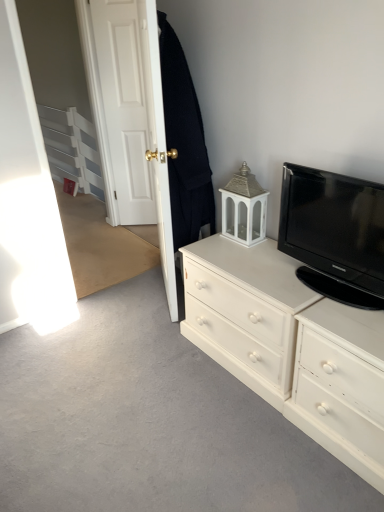
This screenshot has width=384, height=512. I want to click on vacant region below white wooden door at upper left, acting as the second door starting from the left (from a real-world perspective), so click(135, 238).